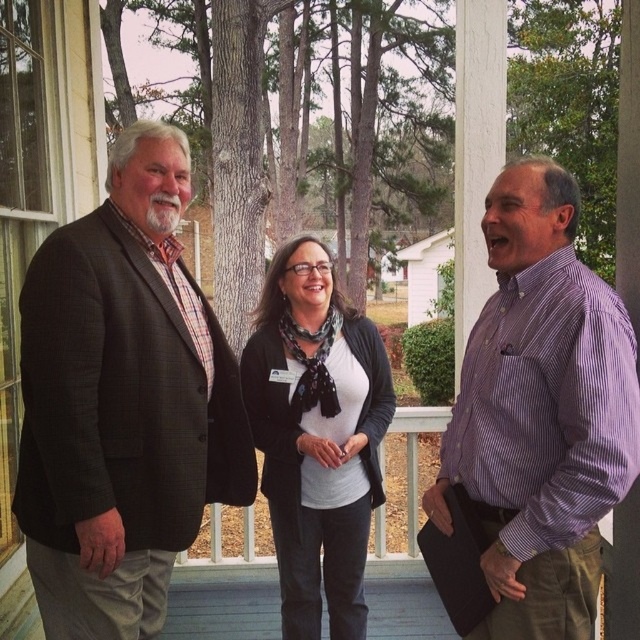
Question: Based on their relative distances, which object is farther from the matte black briefcase at center?

Choices:
 (A) purple striped shirt at center
 (B) white matte shirt at center
 (C) plaid fabric shirt at left

Answer: (A)

Question: Which point is farther to the camera?

Choices:
 (A) purple striped shirt at center
 (B) plaid fabric shirt at left

Answer: (B)

Question: Does purple striped shirt at center have a lesser width compared to white matte shirt at center?

Choices:
 (A) yes
 (B) no

Answer: (A)

Question: Is plaid fabric shirt at left positioned in front of purple striped shirt at center?

Choices:
 (A) yes
 (B) no

Answer: (B)

Question: Which object appears closest to the camera in this image?

Choices:
 (A) plaid fabric shirt at left
 (B) white matte shirt at center

Answer: (A)

Question: Can you confirm if white matte shirt at center is positioned below matte black briefcase at center?

Choices:
 (A) yes
 (B) no

Answer: (B)